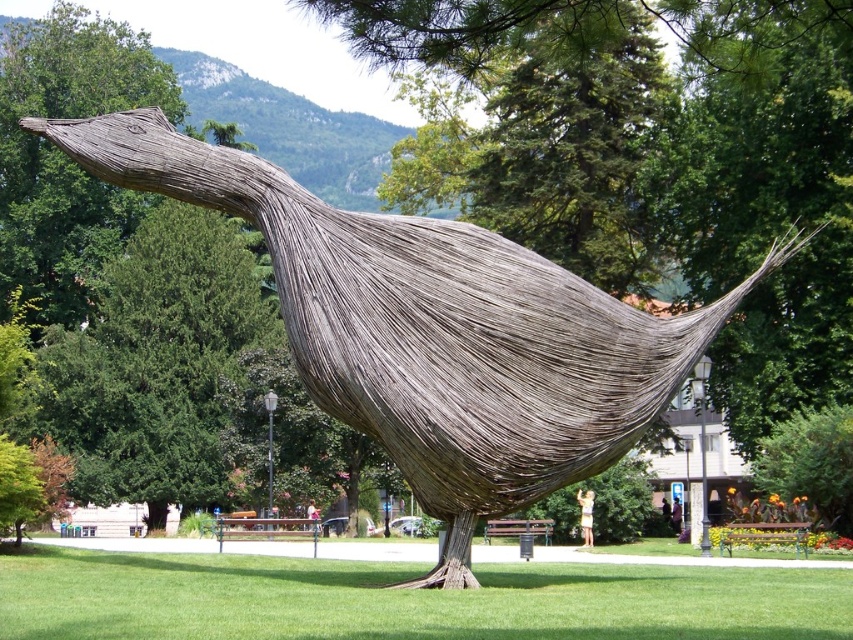
Based on the photo, you are a park visitor standing at the base of the sculpture. Looking up, you notice the natural wood bird at center and the green grass at lower center. Which object is positioned higher relative to the other?

The natural wood bird at center is located above the green grass at lower center, so it is positioned higher.